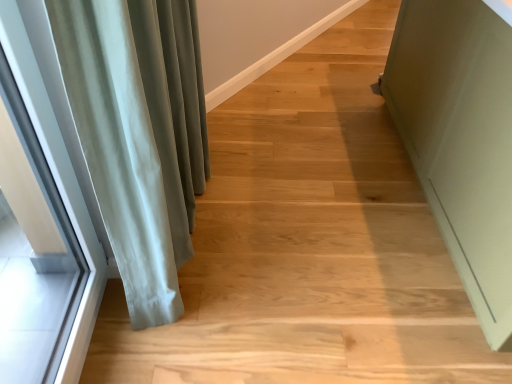
Measure the distance between satin green curtain at left and camera.

The distance of satin green curtain at left from camera is 78.08 centimeters.

Measure the distance between point (76, 177) and camera.

They are 4.04 feet apart.

Where is `matte green cabinet at right`? This screenshot has height=384, width=512. matte green cabinet at right is located at coordinates (461, 139).

How far apart are satin green curtain at left and matte green cabinet at right?

They are 3.38 feet apart.

Is point (189, 21) closer or farther from the camera than point (497, 213)?

Point (189, 21).

Considering the sizes of objects satin green curtain at left and matte green cabinet at right in the image provided, who is smaller, satin green curtain at left or matte green cabinet at right?

With smaller size is satin green curtain at left.

Can you confirm if satin green curtain at left is thinner than matte green cabinet at right?

Correct, the width of satin green curtain at left is less than that of matte green cabinet at right.

Would you say clear glass window at left is inside or outside matte green cabinet at right?

clear glass window at left cannot be found inside matte green cabinet at right.

How many degrees apart are the facing directions of clear glass window at left and matte green cabinet at right?

The angular difference between clear glass window at left and matte green cabinet at right is 0.913 degrees.

Is clear glass window at left further to camera compared to matte green cabinet at right?

No.

From the image's perspective, which is above, clear glass window at left or matte green cabinet at right?

matte green cabinet at right.

Do you think matte green cabinet at right is within clear glass window at left, or outside of it?

matte green cabinet at right is spatially situated outside clear glass window at left.

Measure the distance between matte green cabinet at right and clear glass window at left.

matte green cabinet at right is 1.39 meters away from clear glass window at left.

Considering their positions, is matte green cabinet at right located in front of or behind clear glass window at left?

matte green cabinet at right is behind clear glass window at left.

Between point (391, 85) and point (30, 91), which one is positioned in front?

The point (30, 91) is more forward.

Is matte green cabinet at right placed right next to satin green curtain at left?

No, matte green cabinet at right is not with satin green curtain at left.

Is matte green cabinet at right turned away from satin green curtain at left?

Yes, matte green cabinet at right is facing away from satin green curtain at left.

Which is more distant, (415,97) or (148,42)?

The point (415,97) is farther.

How many degrees apart are the facing directions of satin green curtain at left and clear glass window at left?

1.42 degrees separate the facing orientations of satin green curtain at left and clear glass window at left.

Are satin green curtain at left and clear glass window at left located far from each other?

No, satin green curtain at left is not far from clear glass window at left.

From the image's perspective, relative to clear glass window at left, is satin green curtain at left above or below?

Clearly, from the image's perspective, satin green curtain at left is above clear glass window at left.

In terms of width, does satin green curtain at left look wider or thinner when compared to clear glass window at left?

Considering their sizes, satin green curtain at left looks broader than clear glass window at left.

Is clear glass window at left bigger than satin green curtain at left?

Actually, clear glass window at left might be smaller than satin green curtain at left.

From the image's perspective, which is below, clear glass window at left or satin green curtain at left?

clear glass window at left, from the image's perspective.

Locate an element on the screen. This screenshot has height=384, width=512. window located above the satin green curtain at left (from a real-world perspective) is located at coordinates pyautogui.click(x=41, y=212).

Which of these two, clear glass window at left or satin green curtain at left, stands shorter?

satin green curtain at left is shorter.

Identify the location of curtain behind the matte green cabinet at right. The height and width of the screenshot is (384, 512). (139, 134).

At what (x,y) coordinates should I click in order to perform the action: click on window located below the matte green cabinet at right (from the image's perspective). Please return your answer as a coordinate pair (x, y). Looking at the image, I should click on (41, 212).

From the picture: Considering their positions, is clear glass window at left positioned further to satin green curtain at left than matte green cabinet at right?

Among the two, matte green cabinet at right is located further to satin green curtain at left.

Considering their positions, is satin green curtain at left positioned closer to matte green cabinet at right than clear glass window at left?

The object closer to matte green cabinet at right is satin green curtain at left.

In the scene shown: Which object lies further to the anchor point clear glass window at left, matte green cabinet at right or satin green curtain at left?

Based on the image, matte green cabinet at right appears to be further to clear glass window at left.

Looking at the image, which one is located further to clear glass window at left, satin green curtain at left or matte green cabinet at right?

matte green cabinet at right.

Which object lies nearer to the anchor point satin green curtain at left, matte green cabinet at right or clear glass window at left?

clear glass window at left is closer to satin green curtain at left.

Looking at the image, which one is located further to matte green cabinet at right, clear glass window at left or satin green curtain at left?

Based on the image, clear glass window at left appears to be further to matte green cabinet at right.

The image size is (512, 384). What are the coordinates of `curtain between clear glass window at left and matte green cabinet at right in the horizontal direction` in the screenshot? It's located at (139, 134).